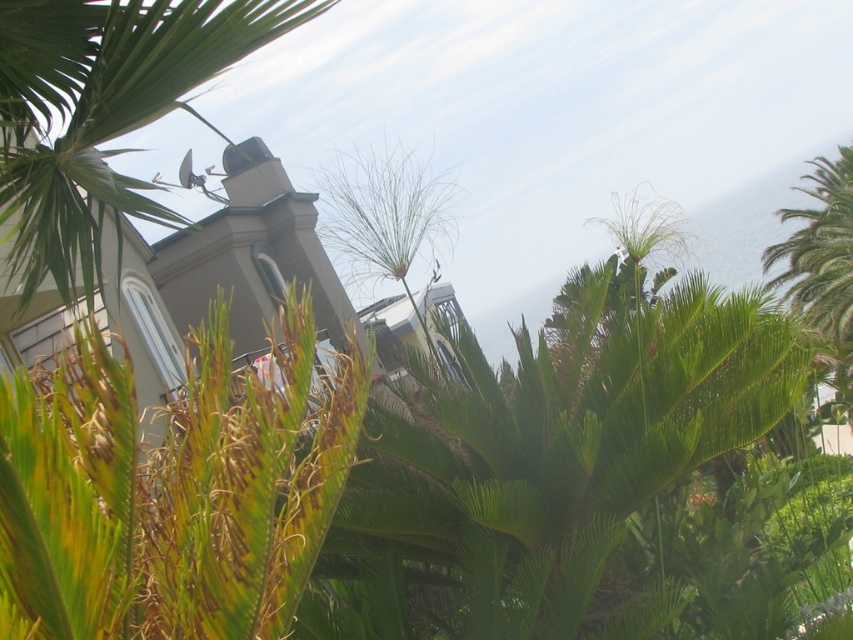
Question: Is green leafy palm tree at upper left wider than green leafy palm tree at upper right?

Choices:
 (A) no
 (B) yes

Answer: (A)

Question: Which point is farther to the camera?

Choices:
 (A) (80, 228)
 (B) (844, 336)

Answer: (B)

Question: Which of the following is the farthest from the observer?

Choices:
 (A) green leafy palm tree at upper left
 (B) green leafy palm tree at upper right

Answer: (B)

Question: Can you confirm if green leafy palm tree at upper left is smaller than green leafy palm tree at upper right?

Choices:
 (A) yes
 (B) no

Answer: (A)

Question: Is green leafy palm tree at upper left below green leafy palm tree at upper right?

Choices:
 (A) yes
 (B) no

Answer: (A)